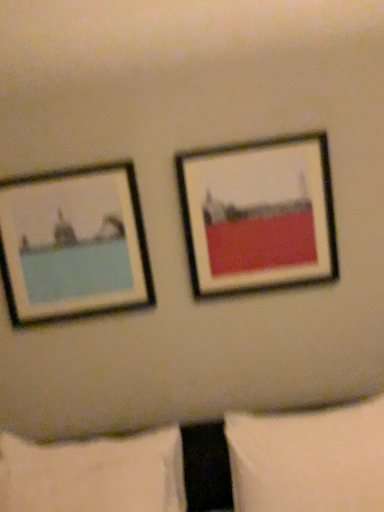
The width and height of the screenshot is (384, 512). What do you see at coordinates (258, 215) in the screenshot?
I see `matte black picture frame at upper right, the first picture frame when ordered from right to left` at bounding box center [258, 215].

Image resolution: width=384 pixels, height=512 pixels. Describe the element at coordinates (94, 475) in the screenshot. I see `white soft pillow at lower left, positioned as the 1th pillow in left-to-right order` at that location.

What do you see at coordinates (73, 244) in the screenshot? I see `matte black picture frame at left, which appears as the second picture frame when viewed from the right` at bounding box center [73, 244].

I want to click on matte black picture frame at upper right, the first picture frame when ordered from right to left, so click(x=258, y=215).

This screenshot has width=384, height=512. What are the coordinates of `the 2nd pillow below the matte black picture frame at upper right, the first picture frame when ordered from right to left (from the image's perspective)` in the screenshot? It's located at (94, 475).

Does matte black picture frame at upper right, placed as the 2th picture frame when sorted from left to right, have a greater width compared to white soft pillow at lower left, positioned as the 1th pillow in left-to-right order?

In fact, matte black picture frame at upper right, placed as the 2th picture frame when sorted from left to right, might be narrower than white soft pillow at lower left, positioned as the 1th pillow in left-to-right order.

Is matte black picture frame at upper right, the first picture frame when ordered from right to left, closer to the viewer compared to white soft pillow at lower left, positioned as the 1th pillow in left-to-right order?

No.

Between point (277, 229) and point (383, 479), which one is positioned behind?

Point (277, 229)

Which is more to the right, matte black picture frame at upper right, the first picture frame when ordered from right to left, or white soft pillow at lower right, positioned as the 2th pillow in left-to-right order?

Positioned to the right is white soft pillow at lower right, positioned as the 2th pillow in left-to-right order.

Is matte black picture frame at upper right, the first picture frame when ordered from right to left, completely or partially outside of white soft pillow at lower right, the first pillow in the right-to-left sequence?

matte black picture frame at upper right, the first picture frame when ordered from right to left, is positioned outside white soft pillow at lower right, the first pillow in the right-to-left sequence.

Are matte black picture frame at upper right, the first picture frame when ordered from right to left, and white soft pillow at lower right, positioned as the 2th pillow in left-to-right order, far apart?

No, matte black picture frame at upper right, the first picture frame when ordered from right to left, is not far away from white soft pillow at lower right, positioned as the 2th pillow in left-to-right order.

Based on the photo, considering the sizes of objects white soft pillow at lower right, the first pillow in the right-to-left sequence, and matte black picture frame at left, which appears as the second picture frame when viewed from the right, in the image provided, who is shorter, white soft pillow at lower right, the first pillow in the right-to-left sequence, or matte black picture frame at left, which appears as the second picture frame when viewed from the right,?

white soft pillow at lower right, the first pillow in the right-to-left sequence, is shorter.

From the picture: Can matte black picture frame at left, which is the 1th picture frame from left to right, be found inside white soft pillow at lower right, positioned as the 2th pillow in left-to-right order?

No, matte black picture frame at left, which is the 1th picture frame from left to right, is not surrounded by white soft pillow at lower right, positioned as the 2th pillow in left-to-right order.

Does point (348, 471) appear closer or farther from the camera than point (78, 296)?

Point (348, 471) is positioned closer to the camera compared to point (78, 296).

Consider the image. Does white soft pillow at lower right, positioned as the 2th pillow in left-to-right order, contain matte black picture frame at upper right, placed as the 2th picture frame when sorted from left to right?

No, matte black picture frame at upper right, placed as the 2th picture frame when sorted from left to right, is not inside white soft pillow at lower right, positioned as the 2th pillow in left-to-right order.

Which is further, (257, 429) or (299, 197)?

Point (299, 197)

Considering the sizes of objects white soft pillow at lower right, the first pillow in the right-to-left sequence, and matte black picture frame at upper right, placed as the 2th picture frame when sorted from left to right, in the image provided, who is taller, white soft pillow at lower right, the first pillow in the right-to-left sequence, or matte black picture frame at upper right, placed as the 2th picture frame when sorted from left to right,?

With more height is matte black picture frame at upper right, placed as the 2th picture frame when sorted from left to right.

From the image's perspective, between white soft pillow at lower right, positioned as the 2th pillow in left-to-right order, and matte black picture frame at upper right, placed as the 2th picture frame when sorted from left to right, which one is located above?

matte black picture frame at upper right, placed as the 2th picture frame when sorted from left to right, appears higher in the image.

Is white soft pillow at lower right, the first pillow in the right-to-left sequence, located outside white soft pillow at lower left, marked as the second pillow in a right-to-left arrangement?

Yes, white soft pillow at lower right, the first pillow in the right-to-left sequence, is not within white soft pillow at lower left, marked as the second pillow in a right-to-left arrangement.

Which object is positioned more to the right, white soft pillow at lower right, positioned as the 2th pillow in left-to-right order, or white soft pillow at lower left, positioned as the 1th pillow in left-to-right order?

Positioned to the right is white soft pillow at lower right, positioned as the 2th pillow in left-to-right order.

From a real-world perspective, is white soft pillow at lower right, positioned as the 2th pillow in left-to-right order, physically located above or below white soft pillow at lower left, positioned as the 1th pillow in left-to-right order?

white soft pillow at lower right, positioned as the 2th pillow in left-to-right order, is below white soft pillow at lower left, positioned as the 1th pillow in left-to-right order.

Based on the photo, between white soft pillow at lower left, marked as the second pillow in a right-to-left arrangement, and matte black picture frame at left, which appears as the second picture frame when viewed from the right, which one is positioned behind?

matte black picture frame at left, which appears as the second picture frame when viewed from the right, is further from the camera.

Consider the image. How much distance is there between white soft pillow at lower left, positioned as the 1th pillow in left-to-right order, and matte black picture frame at left, which is the 1th picture frame from left to right?

The distance of white soft pillow at lower left, positioned as the 1th pillow in left-to-right order, from matte black picture frame at left, which is the 1th picture frame from left to right, is 25.07 inches.

Can matte black picture frame at left, which is the 1th picture frame from left to right, be found inside white soft pillow at lower left, marked as the second pillow in a right-to-left arrangement?

Actually, matte black picture frame at left, which is the 1th picture frame from left to right, is outside white soft pillow at lower left, marked as the second pillow in a right-to-left arrangement.

Does white soft pillow at lower left, positioned as the 1th pillow in left-to-right order, have a smaller size compared to matte black picture frame at left, which appears as the second picture frame when viewed from the right?

Incorrect, white soft pillow at lower left, positioned as the 1th pillow in left-to-right order, is not smaller in size than matte black picture frame at left, which appears as the second picture frame when viewed from the right.

Is matte black picture frame at left, which is the 1th picture frame from left to right, positioned with its back to white soft pillow at lower right, the first pillow in the right-to-left sequence?

matte black picture frame at left, which is the 1th picture frame from left to right, is not turned away from white soft pillow at lower right, the first pillow in the right-to-left sequence.

Which point is more distant from viewer, (96, 208) or (321, 486)?

Positioned behind is point (96, 208).

Considering the relative sizes of matte black picture frame at left, which is the 1th picture frame from left to right, and white soft pillow at lower right, the first pillow in the right-to-left sequence, in the image provided, is matte black picture frame at left, which is the 1th picture frame from left to right, thinner than white soft pillow at lower right, the first pillow in the right-to-left sequence,?

Indeed, matte black picture frame at left, which is the 1th picture frame from left to right, has a lesser width compared to white soft pillow at lower right, the first pillow in the right-to-left sequence.

Looking at the image, does matte black picture frame at left, which is the 1th picture frame from left to right, seem bigger or smaller compared to white soft pillow at lower right, the first pillow in the right-to-left sequence?

Considering their sizes, matte black picture frame at left, which is the 1th picture frame from left to right, takes up less space than white soft pillow at lower right, the first pillow in the right-to-left sequence.

Locate an element on the screen. The height and width of the screenshot is (512, 384). picture frame that is the 1st one when counting backward from the white soft pillow at lower left, marked as the second pillow in a right-to-left arrangement is located at coordinates (258, 215).

Which picture frame is the 1st one when counting from the left side of the white soft pillow at lower right, positioned as the 2th pillow in left-to-right order? Please provide its 2D coordinates.

[(258, 215)]

When comparing their distances from white soft pillow at lower right, the first pillow in the right-to-left sequence, does matte black picture frame at upper right, the first picture frame when ordered from right to left, or white soft pillow at lower left, positioned as the 1th pillow in left-to-right order, seem further?

The object further to white soft pillow at lower right, the first pillow in the right-to-left sequence, is matte black picture frame at upper right, the first picture frame when ordered from right to left.

Considering their positions, is matte black picture frame at left, which appears as the second picture frame when viewed from the right, positioned closer to matte black picture frame at upper right, placed as the 2th picture frame when sorted from left to right, than white soft pillow at lower left, positioned as the 1th pillow in left-to-right order?

matte black picture frame at left, which appears as the second picture frame when viewed from the right, is positioned closer to the anchor matte black picture frame at upper right, placed as the 2th picture frame when sorted from left to right.

Looking at the image, which one is located closer to matte black picture frame at left, which appears as the second picture frame when viewed from the right, white soft pillow at lower left, marked as the second pillow in a right-to-left arrangement, or white soft pillow at lower right, positioned as the 2th pillow in left-to-right order?

Based on the image, white soft pillow at lower left, marked as the second pillow in a right-to-left arrangement, appears to be nearer to matte black picture frame at left, which appears as the second picture frame when viewed from the right.

From the picture: When comparing their distances from matte black picture frame at left, which is the 1th picture frame from left to right, does matte black picture frame at upper right, the first picture frame when ordered from right to left, or white soft pillow at lower left, positioned as the 1th pillow in left-to-right order, seem further?

Based on the image, white soft pillow at lower left, positioned as the 1th pillow in left-to-right order, appears to be further to matte black picture frame at left, which is the 1th picture frame from left to right.

When comparing their distances from matte black picture frame at upper right, placed as the 2th picture frame when sorted from left to right, does white soft pillow at lower right, positioned as the 2th pillow in left-to-right order, or white soft pillow at lower left, marked as the second pillow in a right-to-left arrangement, seem further?

white soft pillow at lower left, marked as the second pillow in a right-to-left arrangement, is further to matte black picture frame at upper right, placed as the 2th picture frame when sorted from left to right.

Based on their spatial positions, is white soft pillow at lower right, positioned as the 2th pillow in left-to-right order, or matte black picture frame at upper right, the first picture frame when ordered from right to left, closer to matte black picture frame at left, which appears as the second picture frame when viewed from the right?

Based on the image, matte black picture frame at upper right, the first picture frame when ordered from right to left, appears to be nearer to matte black picture frame at left, which appears as the second picture frame when viewed from the right.

Estimate the real-world distances between objects in this image. Which object is closer to white soft pillow at lower left, positioned as the 1th pillow in left-to-right order, matte black picture frame at left, which appears as the second picture frame when viewed from the right, or white soft pillow at lower right, the first pillow in the right-to-left sequence?

The object closer to white soft pillow at lower left, positioned as the 1th pillow in left-to-right order, is white soft pillow at lower right, the first pillow in the right-to-left sequence.

From the image, which object appears to be farther from white soft pillow at lower right, the first pillow in the right-to-left sequence, matte black picture frame at left, which appears as the second picture frame when viewed from the right, or white soft pillow at lower left, positioned as the 1th pillow in left-to-right order?

Based on the image, matte black picture frame at left, which appears as the second picture frame when viewed from the right, appears to be further to white soft pillow at lower right, the first pillow in the right-to-left sequence.

The width and height of the screenshot is (384, 512). What are the coordinates of `pillow between matte black picture frame at left, which appears as the second picture frame when viewed from the right, and white soft pillow at lower left, positioned as the 1th pillow in left-to-right order, vertically` in the screenshot? It's located at (308, 460).

Locate an element on the screen. Image resolution: width=384 pixels, height=512 pixels. picture frame that lies between matte black picture frame at upper right, placed as the 2th picture frame when sorted from left to right, and white soft pillow at lower right, positioned as the 2th pillow in left-to-right order, from top to bottom is located at coordinates (73, 244).

Image resolution: width=384 pixels, height=512 pixels. In order to click on picture frame between matte black picture frame at upper right, the first picture frame when ordered from right to left, and white soft pillow at lower left, marked as the second pillow in a right-to-left arrangement, in the vertical direction in this screenshot , I will do click(x=73, y=244).

The image size is (384, 512). What are the coordinates of `pillow between matte black picture frame at upper right, placed as the 2th picture frame when sorted from left to right, and white soft pillow at lower left, positioned as the 1th pillow in left-to-right order, vertically` in the screenshot? It's located at (308, 460).